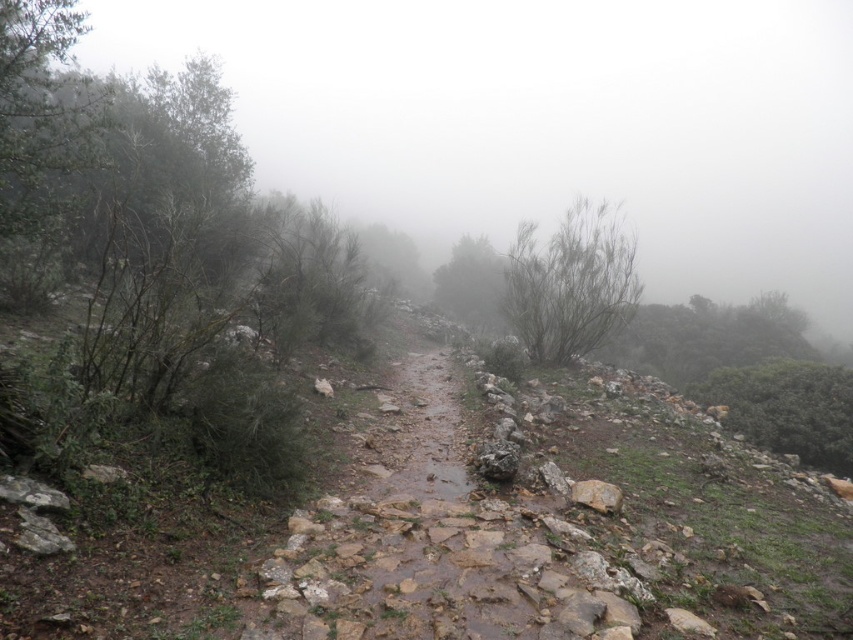
Question: Which object is positioned closest to the green matte bush at center?

Choices:
 (A) green leafy bush at right
 (B) green leafy bush at upper right

Answer: (B)

Question: In this image, where is green leafy bush at center located relative to green leafy bush at right?

Choices:
 (A) left
 (B) right

Answer: (A)

Question: Which object is farther from the camera taking this photo?

Choices:
 (A) green matte bush at center
 (B) green leafy bush at upper right
 (C) green matte tree at center

Answer: (A)

Question: Is green leafy bush at right to the left of green matte bush at center from the viewer's perspective?

Choices:
 (A) no
 (B) yes

Answer: (A)

Question: Which point appears closest to the camera in this image?

Choices:
 (A) (689, 371)
 (B) (753, 365)
 (C) (419, 275)

Answer: (B)

Question: Observing the image, what is the correct spatial positioning of green leafy bush at center in reference to green leafy bush at right?

Choices:
 (A) left
 (B) right

Answer: (A)